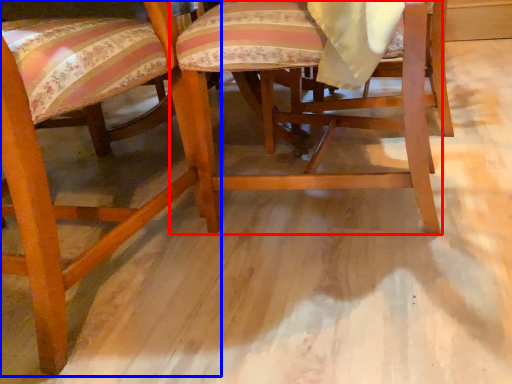
Question: Which point is closer to the camera, chair (highlighted by a red box) or chair (highlighted by a blue box)?

Choices:
 (A) chair
 (B) chair

Answer: (B)